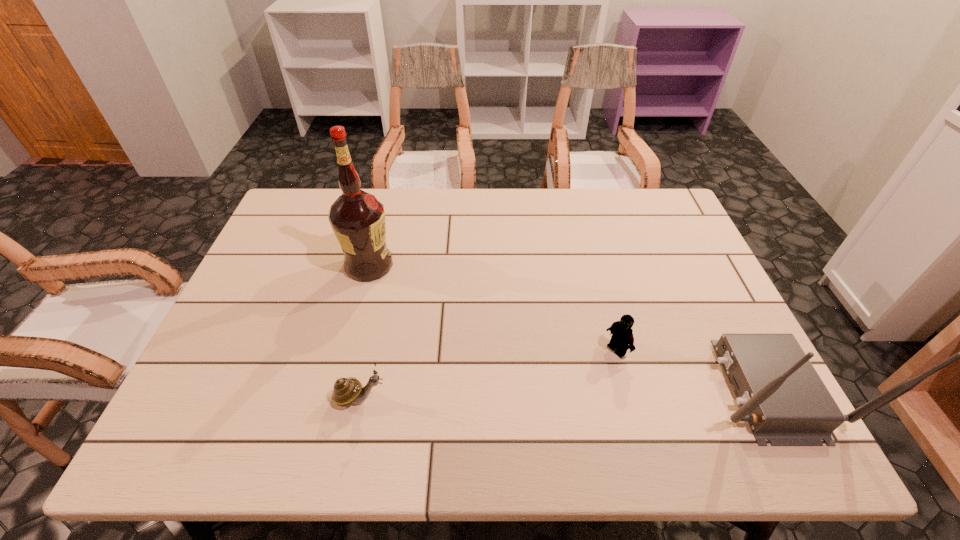
This screenshot has width=960, height=540. I want to click on vacant space at the far edge of the desktop, so click(524, 188).

Identify the location of vacant space at the near edge of the desktop. The height and width of the screenshot is (540, 960). (437, 393).

In the image, there is a desktop. Where is `vacant space at the left edge`? The height and width of the screenshot is (540, 960). vacant space at the left edge is located at coordinates (286, 281).

In the image, there is a desktop. Where is `vacant space at the right edge`? This screenshot has height=540, width=960. vacant space at the right edge is located at coordinates (684, 340).

The image size is (960, 540). I want to click on free point at the near left corner, so click(205, 377).

Identify the location of vacant space at the far right corner. The height and width of the screenshot is (540, 960). (653, 193).

This screenshot has height=540, width=960. Identify the location of vacant space that's between the Lego and the snail. (489, 373).

Identify the location of vacant space in between the router and the Lego. This screenshot has width=960, height=540. (692, 369).

Image resolution: width=960 pixels, height=540 pixels. What are the coordinates of `free space between the rightmost object and the second object from right to left` in the screenshot? It's located at 692,369.

The image size is (960, 540). Find the location of `free spot between the tallest object and the Lego`. free spot between the tallest object and the Lego is located at coordinates 493,307.